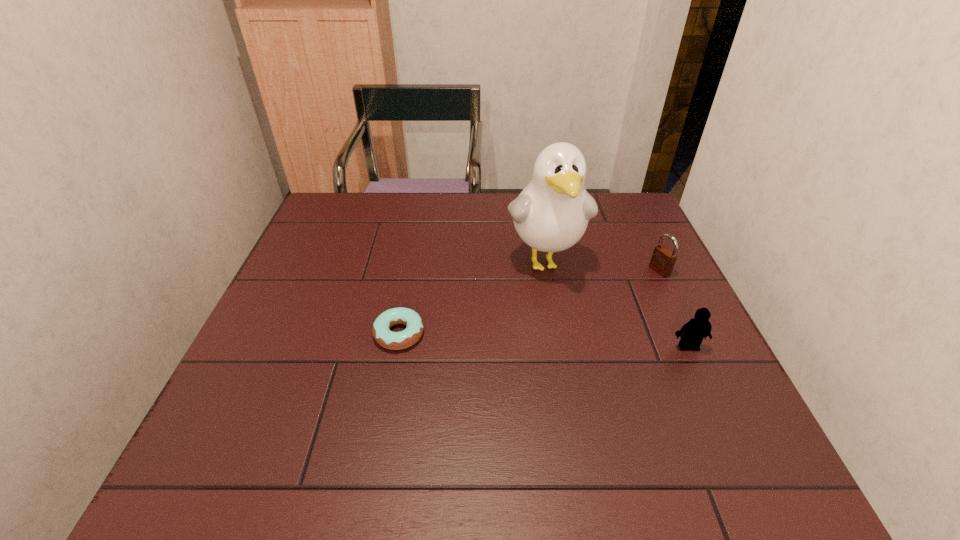
Find the location of a particular element. The height and width of the screenshot is (540, 960). the leftmost object is located at coordinates (381, 331).

Locate an element on the screen. the shortest object is located at coordinates (381, 331).

Find the location of a particular element. Image resolution: width=960 pixels, height=540 pixels. Lego is located at coordinates (698, 327).

Locate an element on the screen. the second object from left to right is located at coordinates (551, 214).

The width and height of the screenshot is (960, 540). In order to click on the tallest object in this screenshot , I will do `click(551, 214)`.

Image resolution: width=960 pixels, height=540 pixels. In order to click on padlock in this screenshot , I will do `click(663, 260)`.

What are the coordinates of `free region located on the front of the shortest object` in the screenshot? It's located at (382, 427).

This screenshot has width=960, height=540. Find the location of `vacant space located 0.190m on the face of the Lego`. vacant space located 0.190m on the face of the Lego is located at coordinates (726, 429).

Find the location of `free space located 0.280m on the beak of the gull`. free space located 0.280m on the beak of the gull is located at coordinates tap(583, 388).

Find the location of a particular element. vacant region located on the beak of the gull is located at coordinates (573, 357).